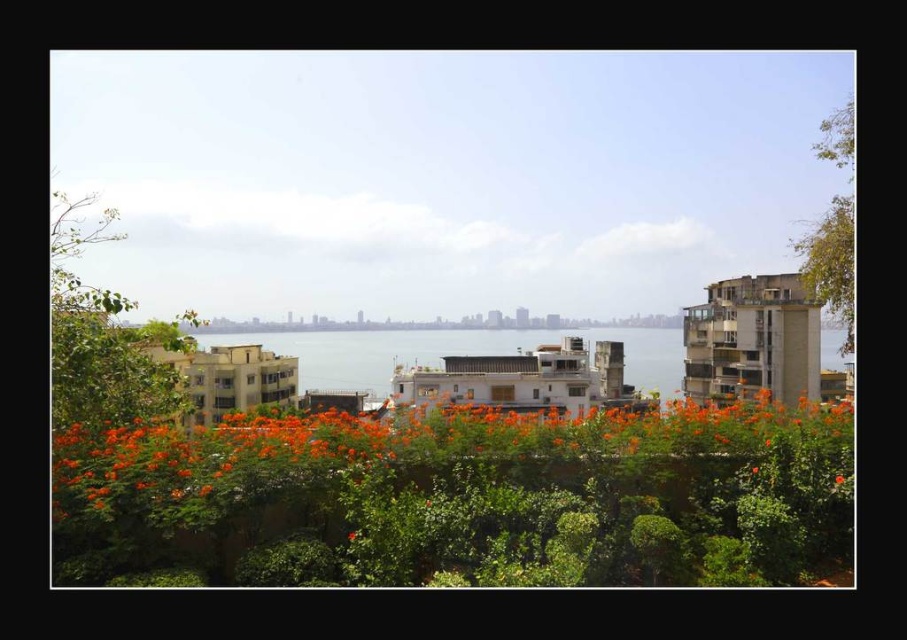
You are standing in the coastal city garden and want to take a photo of both the orange matte flowers at center and the green leafy tree at left. Since you only have a wide angle lens, which object should you position closer to you to include both in the frame?

To include both the orange matte flowers at center and the green leafy tree at left in the frame with a wide angle lens, you should position yourself closer to the orange matte flowers at center since they are located to the right of the green leafy tree at left, allowing both to be captured within the wider angle.

What is the color of the object located at point coordinates [442,454]?

The object at point coordinates [442,454] is orange matte flowers at center, so the color is orange.